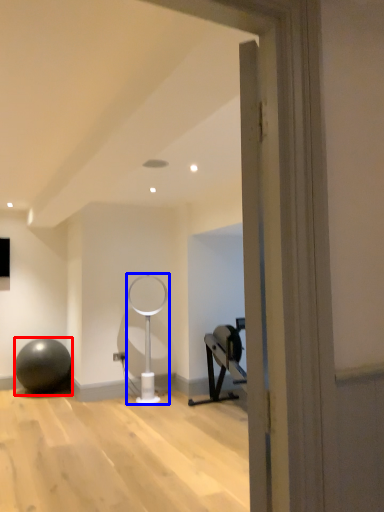
Question: Among these objects, which one is farthest to the camera, ball (highlighted by a red box) or table lamp (highlighted by a blue box)?

Choices:
 (A) ball
 (B) table lamp

Answer: (A)